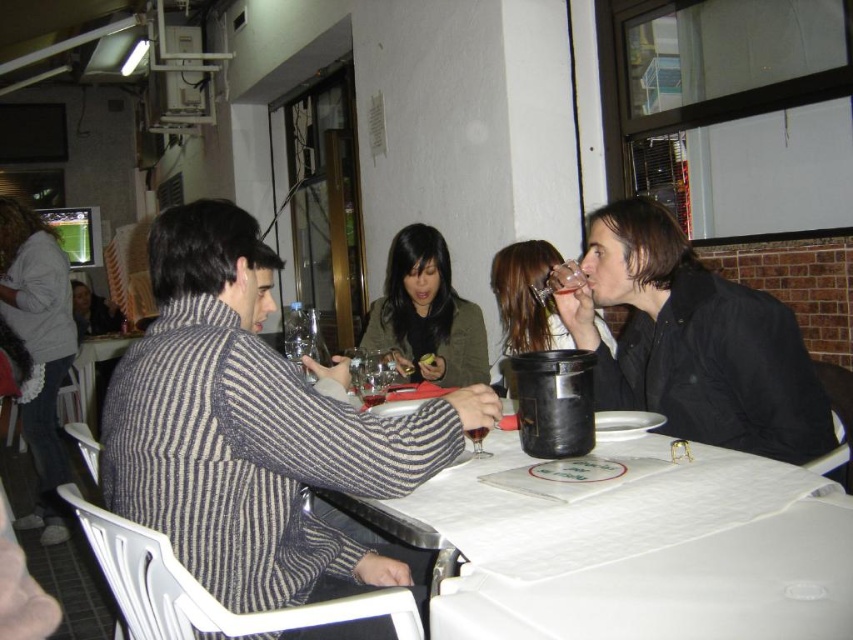
Question: Does transparent glass at center appear on the left side of translucent glass at center?

Choices:
 (A) no
 (B) yes

Answer: (A)

Question: Does black matte jacket at right have a greater width compared to translucent glass at table center?

Choices:
 (A) yes
 (B) no

Answer: (A)

Question: Which is farther from the transparent glass at center?

Choices:
 (A) translucent glass at table center
 (B) translucent glass at center
 (C) striped sweater at left

Answer: (B)

Question: Which of the following is the farthest from the observer?

Choices:
 (A) (648, 403)
 (B) (532, 273)

Answer: (B)

Question: Does striped sweater at left have a larger size compared to white lace dress at left?

Choices:
 (A) yes
 (B) no

Answer: (B)

Question: Which point appears farthest from the camera in this image?

Choices:
 (A) (538, 268)
 (B) (71, 333)

Answer: (B)